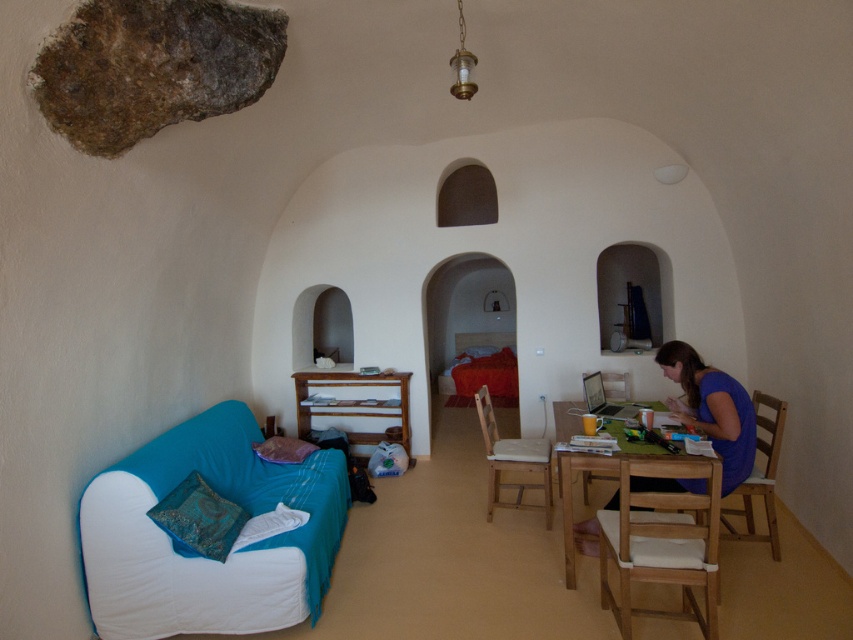
Question: Can you confirm if teal brocade pillow at lower left is bigger than light brown wooden chair at center?

Choices:
 (A) yes
 (B) no

Answer: (B)

Question: Which point is closer to the camera?

Choices:
 (A) (299, 460)
 (B) (639, 496)
 (C) (514, 502)
 (D) (328, 413)

Answer: (B)

Question: Estimate the real-world distances between objects in this image. Which object is farther from the wooden chair at right?

Choices:
 (A) wooden chair at center
 (B) teal fabric couch at lower left
 (C) light brown wooden chair at lower right
 (D) purple fabric pillow at lower left

Answer: (D)

Question: Which object is farther from the camera taking this photo?

Choices:
 (A) teal brocade pillow at lower left
 (B) wooden chair at center
 (C) light brown wooden chair at center

Answer: (C)

Question: Does light brown wooden chair at lower right have a greater width compared to wooden shelf at center?

Choices:
 (A) yes
 (B) no

Answer: (B)

Question: Is light brown wooden chair at lower right closer to the viewer compared to wooden chair at center?

Choices:
 (A) yes
 (B) no

Answer: (A)